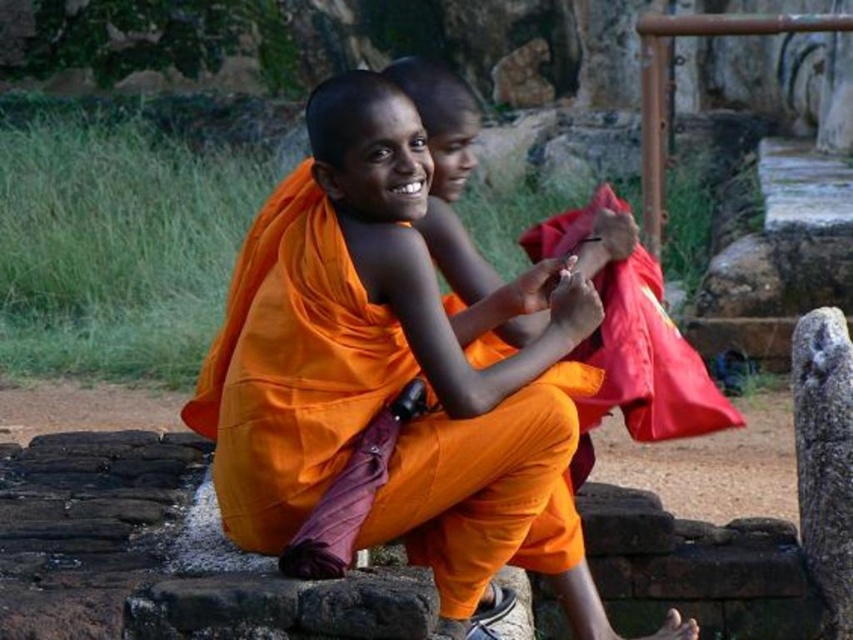
Question: Among these objects, which one is nearest to the camera?

Choices:
 (A) orange cloth at center
 (B) red cloth at center

Answer: (A)

Question: Observing the image, what is the correct spatial positioning of orange cloth at center in reference to red cloth at center?

Choices:
 (A) right
 (B) left

Answer: (B)

Question: Is orange cloth at center to the left of red cloth at center from the viewer's perspective?

Choices:
 (A) no
 (B) yes

Answer: (B)

Question: Among these points, which one is nearest to the camera?

Choices:
 (A) (329, 291)
 (B) (660, 428)

Answer: (A)

Question: Is orange cloth at center to the right of red cloth at center from the viewer's perspective?

Choices:
 (A) no
 (B) yes

Answer: (A)